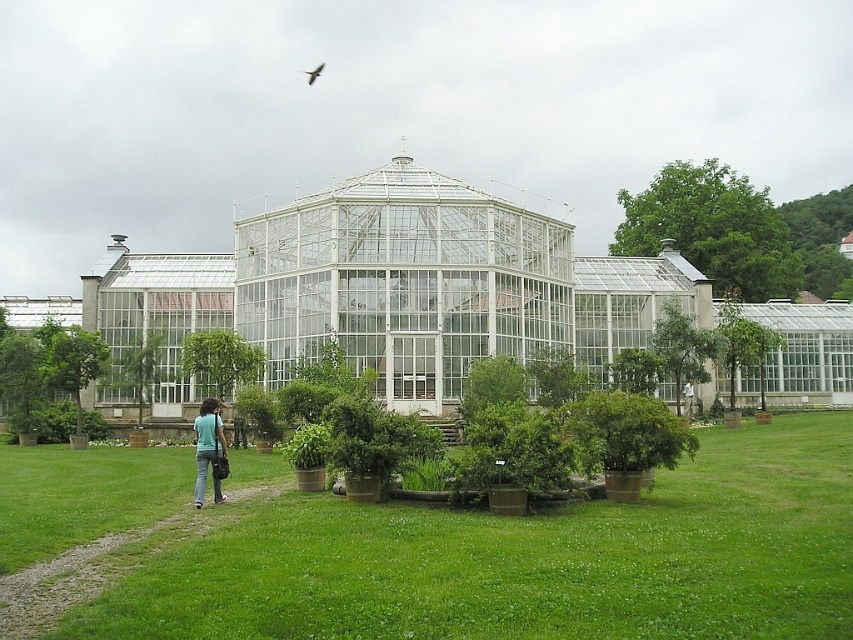
Can you confirm if blue fabric shirt at lower left is positioned to the left of black feathered bird at upper center?

No, blue fabric shirt at lower left is not to the left of black feathered bird at upper center.

Which is behind, point (223, 440) or point (310, 83)?

The point (310, 83) is behind.

Which is behind, point (196, 470) or point (310, 77)?

The point (310, 77) is behind.

This screenshot has width=853, height=640. In order to click on blue fabric shirt at lower left in this screenshot , I will do `click(206, 444)`.

Can you confirm if transparent glass gazebo at center is thinner than blue fabric shirt at lower left?

No, transparent glass gazebo at center is not thinner than blue fabric shirt at lower left.

Who is more distant from viewer, (415, 321) or (200, 406)?

Positioned behind is point (200, 406).

What do you see at coordinates (403, 282) in the screenshot? This screenshot has width=853, height=640. I see `transparent glass gazebo at center` at bounding box center [403, 282].

Locate an element on the screen. Image resolution: width=853 pixels, height=640 pixels. transparent glass gazebo at center is located at coordinates (403, 282).

Locate an element on the screen. green matte potted plants at center is located at coordinates (527, 560).

Describe the element at coordinates (527, 560) in the screenshot. The height and width of the screenshot is (640, 853). I see `green matte potted plants at center` at that location.

The height and width of the screenshot is (640, 853). What are the coordinates of `green matte potted plants at center` in the screenshot? It's located at (527, 560).